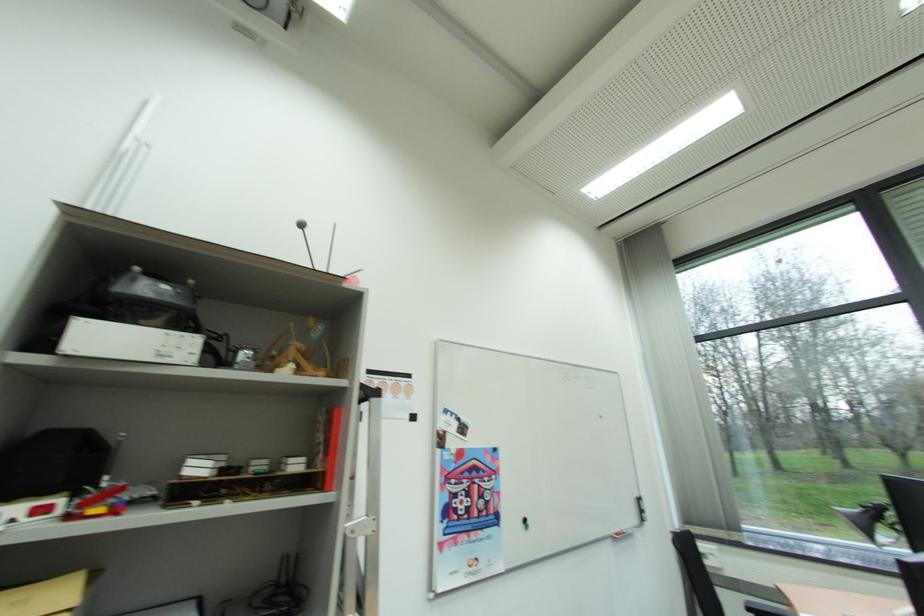
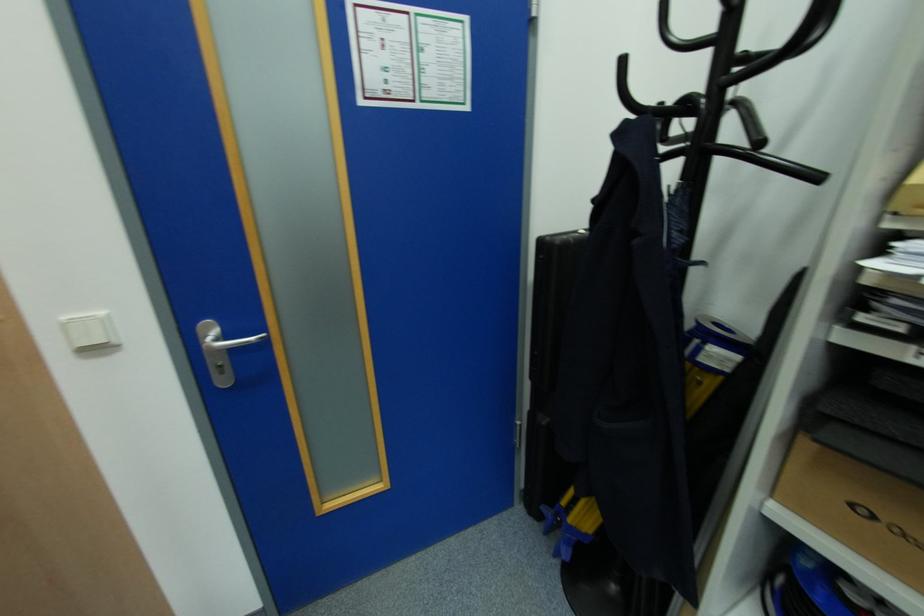
Question: How did the camera likely rotate?

Choices:
 (A) Left
 (B) Right
 (C) Up
 (D) Down

Answer: (A)